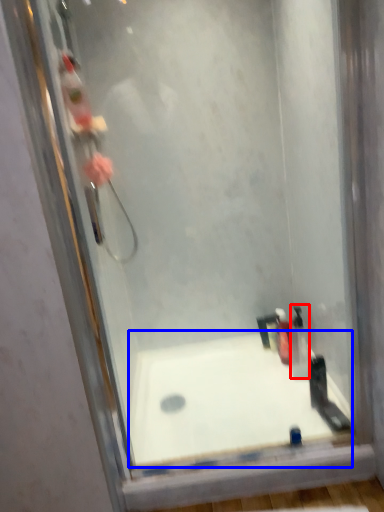
Question: Which object appears farthest to the camera in this image, toiletry (highlighted by a red box) or bathtub (highlighted by a blue box)?

Choices:
 (A) toiletry
 (B) bathtub

Answer: (A)